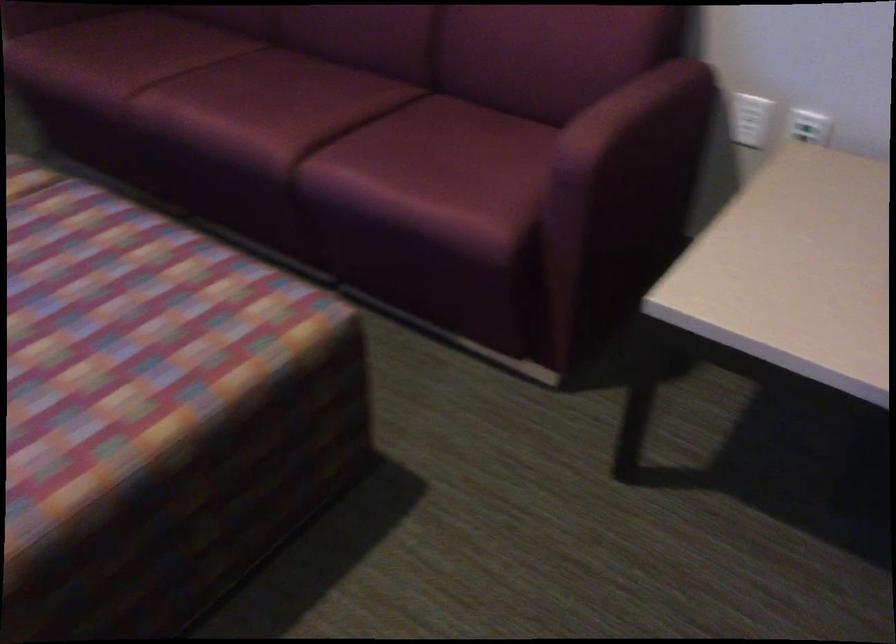
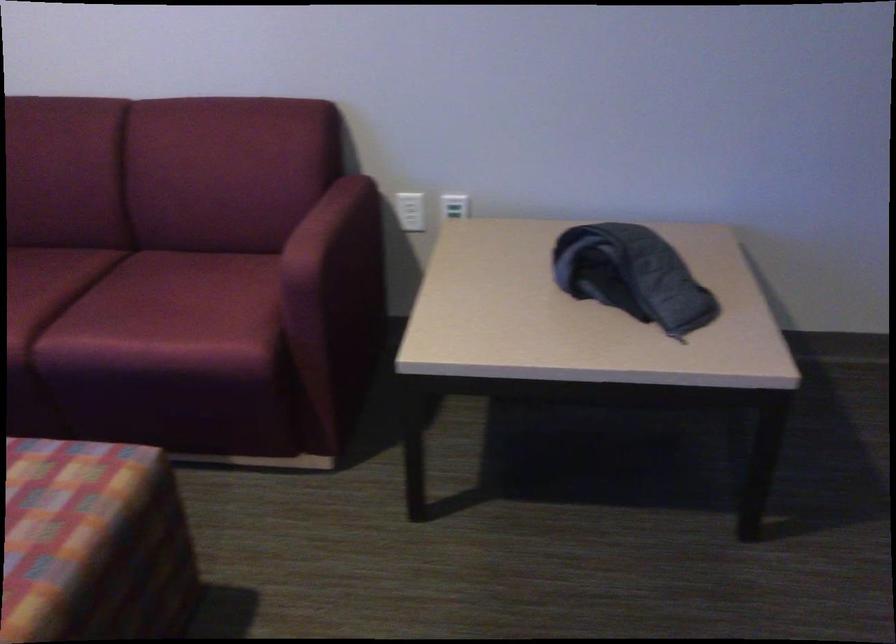
Question: The camera is either moving clockwise (left) or counter-clockwise (right) around the object. The first image is from the beginning of the video and the second image is from the end. Is the camera moving left or right when shooting the video?

Choices:
 (A) Left
 (B) Right

Answer: (A)